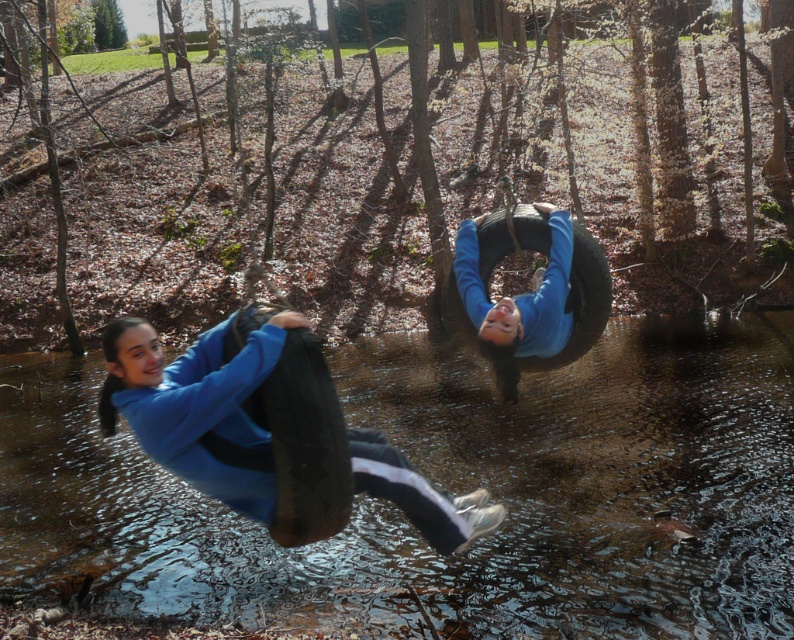
You are standing on the wooden dock and want to jump into the clear water at center. However, you notice the blue matte tire at center is in the way. Can you safely jump into the water without hitting the tire?

The clear water at center has a greater height compared to the blue matte tire at center, so jumping into the clear water at center would not hit the tire since it is higher.

You are standing near the tire swing and want to check the depth of the clear water at center before jumping in. According to the image description, where exactly is the clear water located in relation to your position?

The clear water at center is located at point (451, 492), which means it is positioned to the lower right from your current viewpoint near the tire swing.